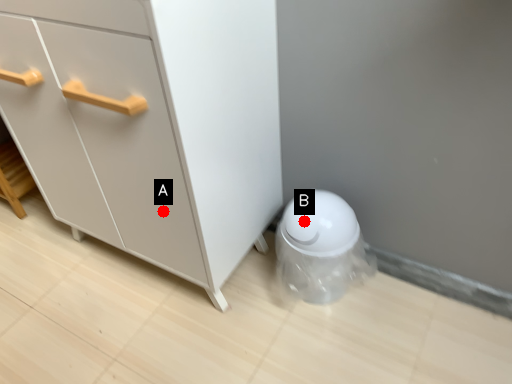
Question: Two points are circled on the image, labeled by A and B beside each circle. Which point is closer to the camera?

Choices:
 (A) A is closer
 (B) B is closer

Answer: (A)